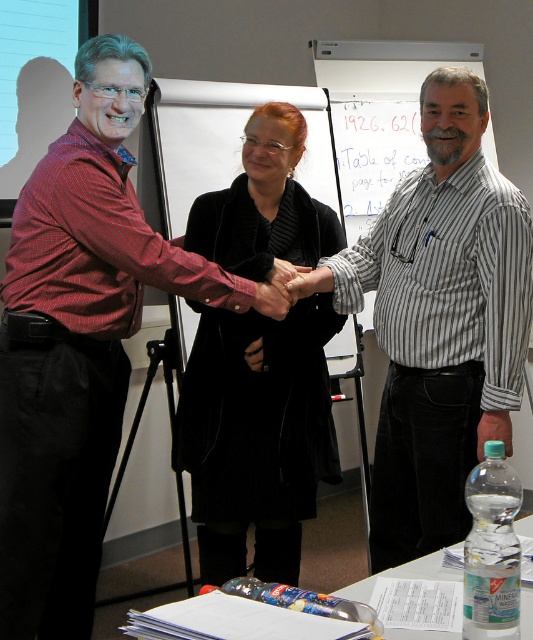
Can you confirm if velvet black coat at center is shorter than matte black hand at center?

Incorrect, velvet black coat at center's height does not fall short of matte black hand at center's.

In the scene shown: Between velvet black coat at center and matte black hand at center, which one is positioned higher?

Positioned higher is matte black hand at center.

Where is `velvet black coat at center`? velvet black coat at center is located at coordinates (256, 435).

Is red checkered shirt at left smaller than matte black hand at center?

Actually, red checkered shirt at left might be larger than matte black hand at center.

Between point (17, 381) and point (264, 308), which one is positioned in front?

Positioned in front is point (17, 381).

This screenshot has height=640, width=533. What are the coordinates of `red checkered shirt at left` in the screenshot? It's located at (77, 342).

Describe the element at coordinates (77, 342) in the screenshot. I see `red checkered shirt at left` at that location.

Is red checkered shirt at left shorter than velvet black coat at center?

In fact, red checkered shirt at left may be taller than velvet black coat at center.

Is point (29, 376) positioned before point (214, 429)?

Yes, it is in front of point (214, 429).

This screenshot has height=640, width=533. Identify the location of red checkered shirt at left. (77, 342).